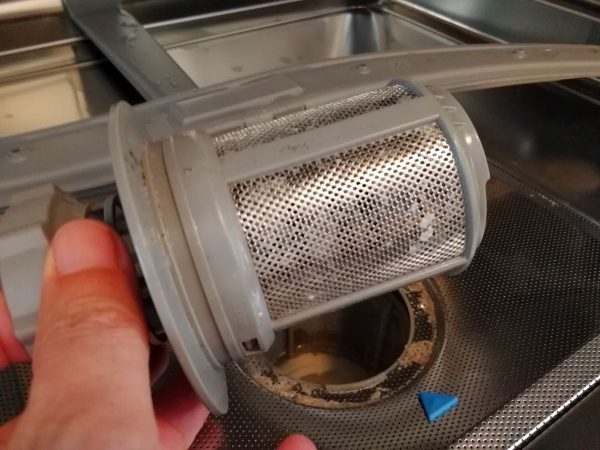
Find the location of a particular element. flange of sink is located at coordinates (443, 27).